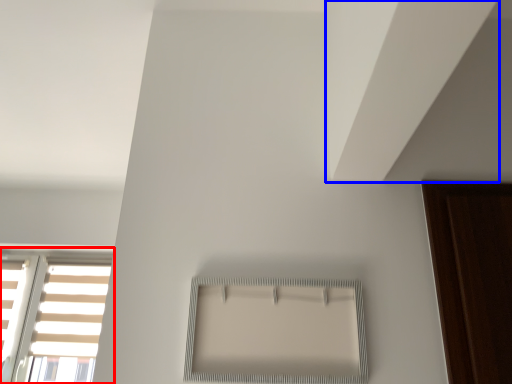
Question: Which of the following is the farthest to the observer, window (highlighted by a red box) or blind (highlighted by a blue box)?

Choices:
 (A) window
 (B) blind

Answer: (A)